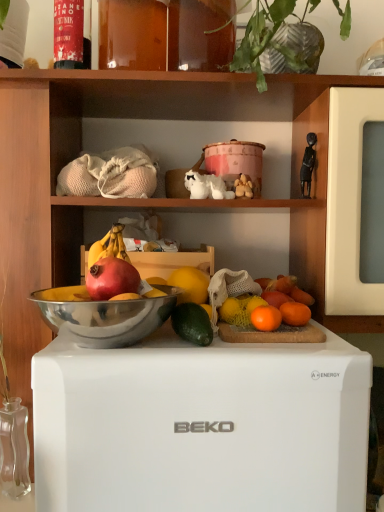
Question: Is green leafy plant at upper center aimed at green matte avocado at center?

Choices:
 (A) yes
 (B) no

Answer: (B)

Question: From a real-world perspective, is green leafy plant at upper center located higher than green matte avocado at center?

Choices:
 (A) no
 (B) yes

Answer: (B)

Question: Is green leafy plant at upper center taller than green matte avocado at center?

Choices:
 (A) no
 (B) yes

Answer: (B)

Question: Is green leafy plant at upper center outside of green matte avocado at center?

Choices:
 (A) no
 (B) yes

Answer: (B)

Question: Can you see green leafy plant at upper center touching green matte avocado at center?

Choices:
 (A) yes
 (B) no

Answer: (B)

Question: Is green matte avocado at center bigger or smaller than white ceramic dog at center?

Choices:
 (A) small
 (B) big

Answer: (A)

Question: Considering the positions of green matte avocado at center and white ceramic dog at center in the image, is green matte avocado at center wider or thinner than white ceramic dog at center?

Choices:
 (A) wide
 (B) thin

Answer: (A)

Question: Is point (183, 308) closer or farther from the camera than point (215, 193)?

Choices:
 (A) farther
 (B) closer

Answer: (B)

Question: In terms of height, does green matte avocado at center look taller or shorter compared to white ceramic dog at center?

Choices:
 (A) tall
 (B) short

Answer: (B)

Question: Relative to red matte grapefruit at center, positioned as the 1th grapefruit in front-to-back order, is black matte figurine at upper right, which ranks as the first toy in right-to-left order, in front or behind?

Choices:
 (A) front
 (B) behind

Answer: (B)

Question: From the image's perspective, is black matte figurine at upper right, which ranks as the second toy in left-to-right order, above or below red matte grapefruit at center, placed as the first grapefruit when sorted from left to right?

Choices:
 (A) below
 (B) above

Answer: (B)

Question: Is point (309, 145) positioned closer to the camera than point (100, 276)?

Choices:
 (A) farther
 (B) closer

Answer: (A)

Question: Considering the relative positions of black matte figurine at upper right, which ranks as the second toy in left-to-right order, and red matte grapefruit at center, positioned as the 1th grapefruit in front-to-back order, in the image provided, is black matte figurine at upper right, which ranks as the second toy in left-to-right order, to the left or to the right of red matte grapefruit at center, positioned as the 1th grapefruit in front-to-back order,?

Choices:
 (A) left
 (B) right

Answer: (B)

Question: Choose the correct answer: Is red matte grapefruit at center, placed as the 3th grapefruit when sorted from back to front, inside orange matte grapefruit at upper right, the second grapefruit from the back, or outside it?

Choices:
 (A) outside
 (B) inside

Answer: (A)

Question: Looking at their shapes, would you say red matte grapefruit at center, positioned as the 1th grapefruit in front-to-back order, is wider or thinner than orange matte grapefruit at upper right, which is counted as the 2th grapefruit, starting from the front?

Choices:
 (A) thin
 (B) wide

Answer: (B)